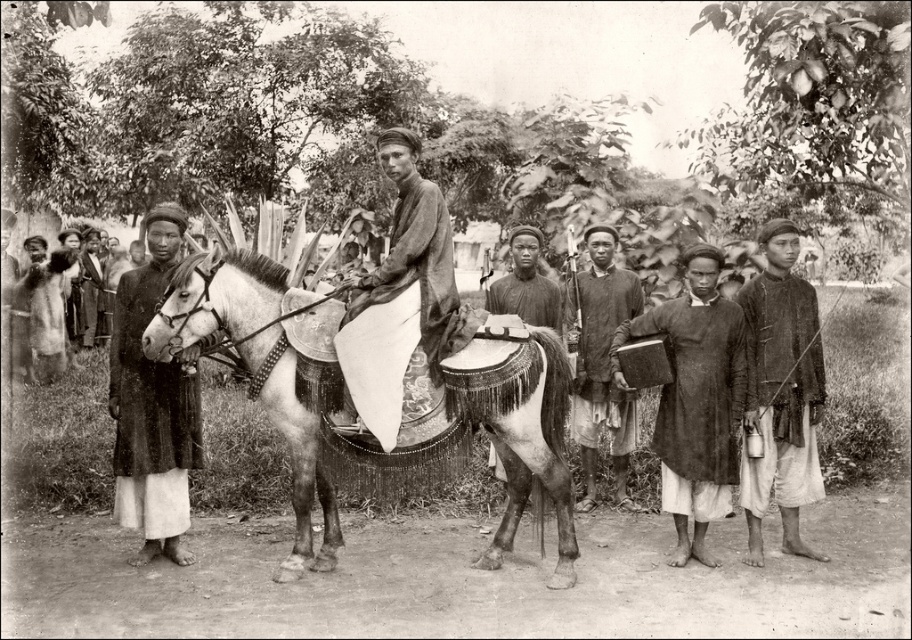
You are a traveler who needs to pack your essentials. You have a smooth white cloth at center and a dark brown leather book at center. Which item can you use to wrap your belongings more effectively?

The smooth white cloth at center can wrap belongings more effectively since its width is larger than the dark brown leather book at center.

You are an artist who wants to sketch the scene. You need to decide which object to draw first based on their sizes. Which one should you start with, the white textured horse at center or the dark brown leather book at center?

The white textured horse at center has a greater height compared to the dark brown leather book at center, so you should start by drawing the white textured horse at center first since it is larger.

You are a photographer analyzing this historical image. You notice the white textured horse at center and the dark brown fabric shirt at right. Based on the scene, which object appears shorter in the image?

The white textured horse at center appears shorter than the dark brown fabric shirt at right in the image.